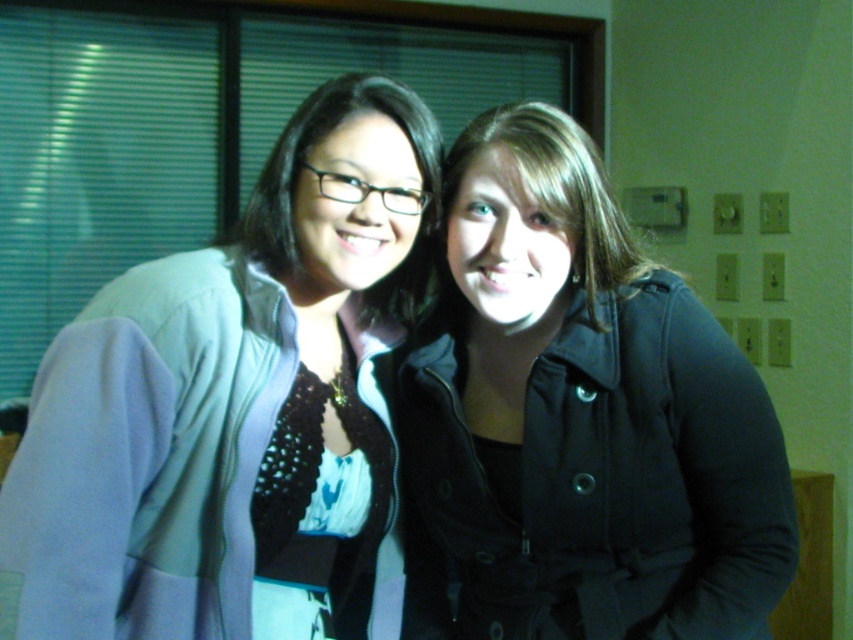
The height and width of the screenshot is (640, 853). I want to click on matte purple jacket at left, so click(236, 410).

Which is behind, point (222, 276) or point (291, 115)?

Point (291, 115)

Image resolution: width=853 pixels, height=640 pixels. I want to click on matte purple jacket at left, so click(236, 410).

Based on the photo, is matte black jacket at center further to the viewer compared to matte black glasses at center?

Yes.

Does matte black jacket at center have a larger size compared to matte black glasses at center?

Yes.

What are the coordinates of `matte black jacket at center` in the screenshot? It's located at (579, 419).

In order to click on matte black jacket at center in this screenshot , I will do `click(579, 419)`.

Is matte purple jacket at left below matte black jacket at center?

No.

Which is behind, point (303, 404) or point (518, 536)?

The point (518, 536) is behind.

Find the location of a particular element. This screenshot has width=853, height=640. matte purple jacket at left is located at coordinates (236, 410).